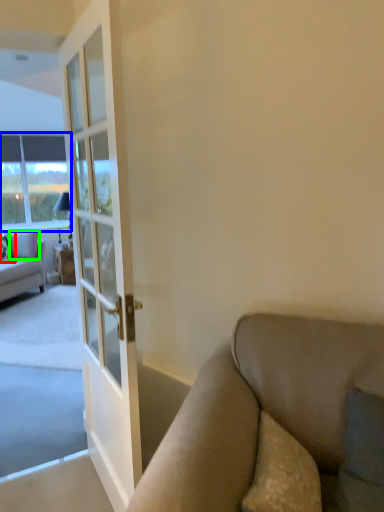
Question: Considering the real-world distances, which object is closest to pillow (highlighted by a red box)? window (highlighted by a blue box) or pillow (highlighted by a green box).

Choices:
 (A) window
 (B) pillow

Answer: (B)